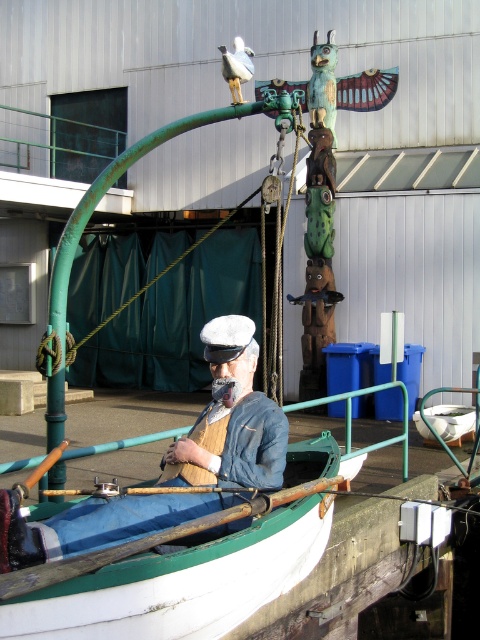
You are standing on the wooden pier and want to place a new bench on the white painted wood boat at center. The bench is as wide as the denim jacket at center. Will the bench fit on the boat?

The white painted wood boat at center might be wider than the denim jacket at center, so the bench could potentially fit, but there is uncertainty due to the comparison being uncertain.

You are standing on the wooden pier and see the white painted wood boat at center and the denim jacket at center. Which object is closer to your left side?

The denim jacket at center is closer to your left side because the white painted wood boat at center is positioned on the right side of denim jacket at center.

You are standing on the wooden pier and see the denim jacket at center and the white matte bird at upper center. Which object is positioned to the right side?

The white matte bird at upper center is positioned to the right of the denim jacket at center.